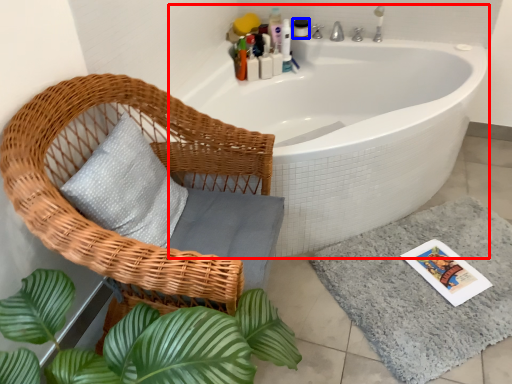
Question: Among these objects, which one is nearest to the camera, bathtub (highlighted by a red box) or toiletry (highlighted by a blue box)?

Choices:
 (A) bathtub
 (B) toiletry

Answer: (A)